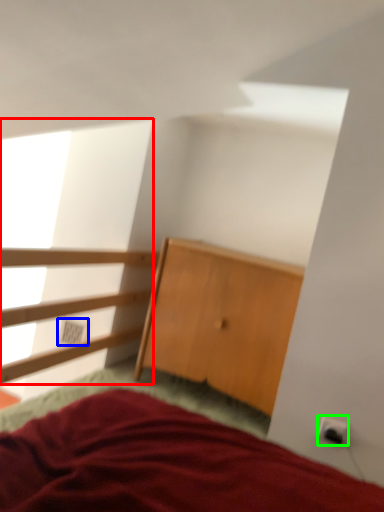
Question: Based on their relative distances, which object is farther from window screen (highlighted by a red box)? Choose from electric outlet (highlighted by a blue box) and electric outlet (highlighted by a green box).

Choices:
 (A) electric outlet
 (B) electric outlet

Answer: (B)